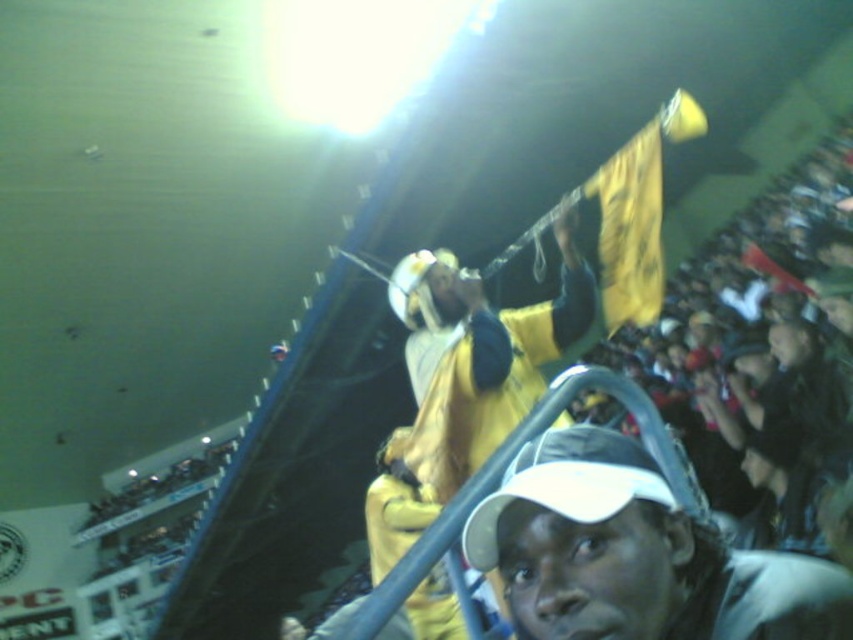
Question: Can you confirm if white matte cap at center is smaller than yellow fabric at upper center?

Choices:
 (A) no
 (B) yes

Answer: (B)

Question: Which point is farther to the camera?

Choices:
 (A) white matte cap at center
 (B) yellow fabric at upper center

Answer: (B)

Question: Is white matte cap at center in front of yellow fabric at upper center?

Choices:
 (A) yes
 (B) no

Answer: (A)

Question: Which point appears farthest from the camera in this image?

Choices:
 (A) coord(421,456)
 (B) coord(492,548)

Answer: (A)

Question: Can you confirm if white matte cap at center is positioned to the right of yellow fabric at upper center?

Choices:
 (A) yes
 (B) no

Answer: (A)

Question: Which of the following is the farthest from the observer?

Choices:
 (A) (427, 440)
 (B) (474, 541)

Answer: (A)